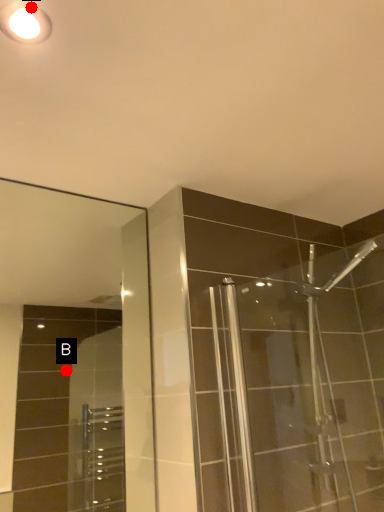
Question: Two points are circled on the image, labeled by A and B beside each circle. Which point is closer to the camera taking this photo?

Choices:
 (A) A is closer
 (B) B is closer

Answer: (A)